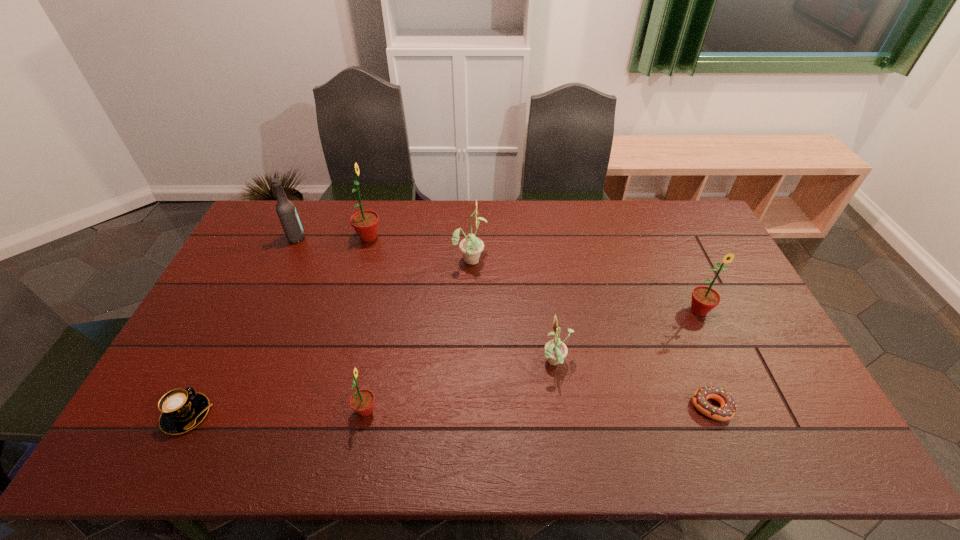
What are the coordinates of `the fourth object from left to right` in the screenshot? It's located at (362, 401).

Identify the location of the seventh tallest object. The height and width of the screenshot is (540, 960). (181, 410).

Where is `cappuccino`? This screenshot has height=540, width=960. cappuccino is located at coordinates (181, 410).

You are a GUI agent. You are given a task and a screenshot of the screen. Output one action in this format:
    pyautogui.click(x=<x>, y=<y>)
    Task: Click on the doughnut
    This screenshot has height=540, width=960.
    Given the screenshot: What is the action you would take?
    pyautogui.click(x=727, y=410)

The image size is (960, 540). Identify the location of the shortest object. (727, 410).

Locate an element on the screen. This screenshot has height=540, width=960. vacant space situated 0.340m on the face of the leftmost sunflower is located at coordinates (477, 237).

I want to click on vacant space positioned 0.190m on the label of the beer bottle, so click(x=358, y=238).

Where is `vacant point located on the front-facing side of the fourth object from right to left`? This screenshot has width=960, height=540. vacant point located on the front-facing side of the fourth object from right to left is located at coordinates (558, 259).

The width and height of the screenshot is (960, 540). In order to click on vacant space located on the face of the rightmost sunflower in this screenshot , I will do `click(723, 363)`.

Where is `free space located 0.200m on the front-facing side of the fourth farthest sunflower`? The width and height of the screenshot is (960, 540). free space located 0.200m on the front-facing side of the fourth farthest sunflower is located at coordinates (467, 363).